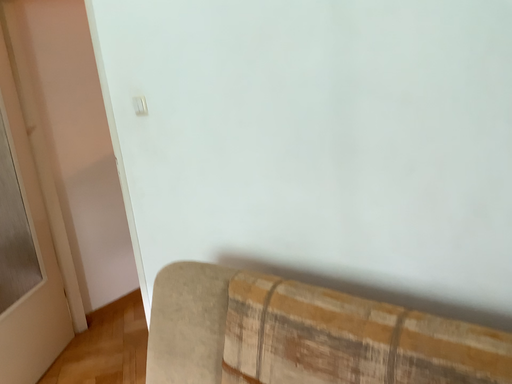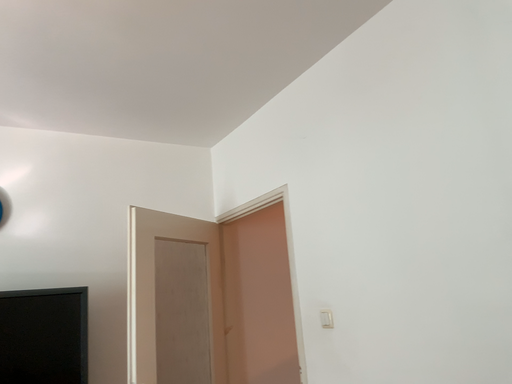
Question: How did the camera likely rotate when shooting the video?

Choices:
 (A) rotated left
 (B) rotated right

Answer: (A)